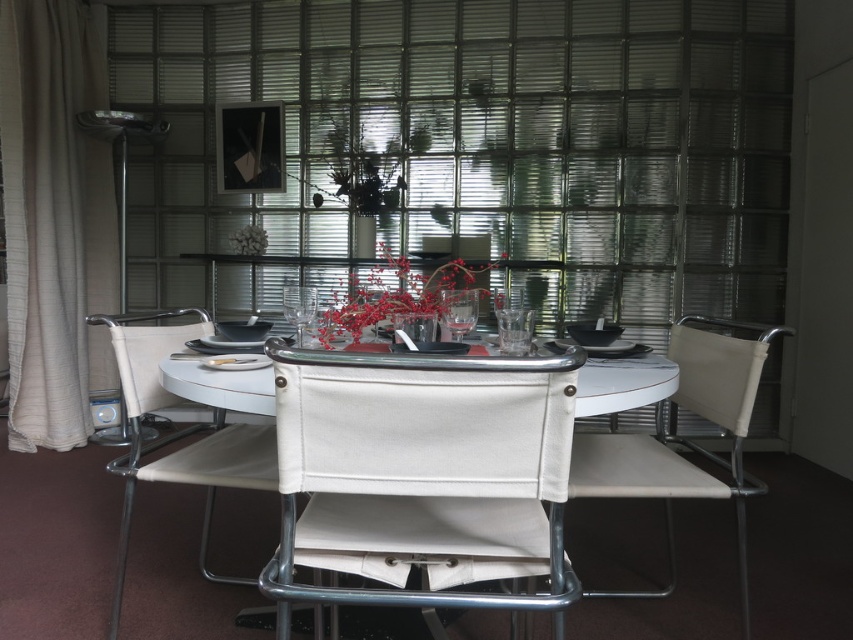
Question: Does white fabric chair at center come behind white fabric chair at left?

Choices:
 (A) yes
 (B) no

Answer: (B)

Question: In this image, where is white canvas chair at center located relative to beige fabric curtain at left?

Choices:
 (A) left
 (B) right

Answer: (B)

Question: Which point appears farthest from the camera in this image?

Choices:
 (A) (384, 305)
 (B) (252, 224)
 (C) (120, 474)

Answer: (B)

Question: Is white canvas chair at center below white matte plate at center?

Choices:
 (A) no
 (B) yes

Answer: (B)

Question: Which point is farther to the camera?

Choices:
 (A) white fabric chair at left
 (B) white matte flower at center
 (C) white canvas chair at center

Answer: (B)

Question: Which object is the closest to the red matte floral arrangement at center?

Choices:
 (A) white canvas chair at center
 (B) white matte plate at center
 (C) beige fabric curtain at left

Answer: (A)